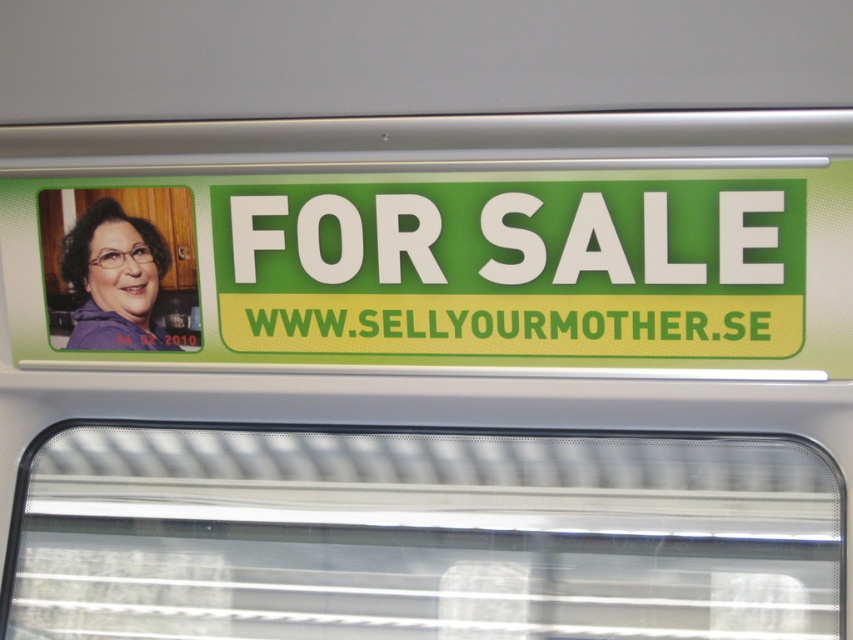
You are trying to determine if the transparent plastic window at center can fit over the matte purple shirt at left. Based on their sizes, will it cover the entire shirt?

The transparent plastic window at center is wider than the matte purple shirt at left, so yes, it can cover the entire shirt.